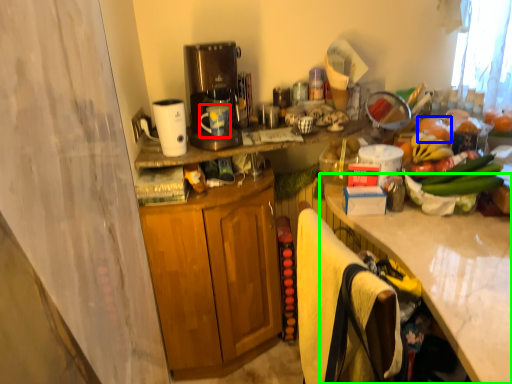
Question: Estimate the real-world distances between objects in this image. Which object is closer to mug (highlighted by a red box), fruit (highlighted by a blue box) or countertop (highlighted by a green box)?

Choices:
 (A) fruit
 (B) countertop

Answer: (A)